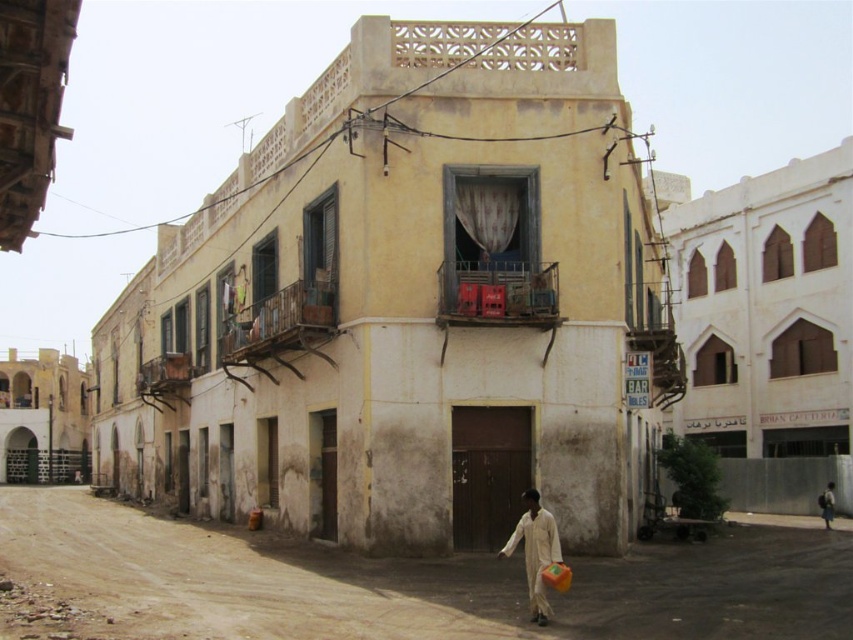
Based on the photo, does white cotton person at lower right have a greater width compared to light brown fabric bag at lower right?

Yes.

Which is in front, point (540, 516) or point (822, 520)?

Point (540, 516)

I want to click on white cotton person at lower right, so click(535, 552).

In the scene shown: Is the position of dull concrete alley at lower left less distant than that of white cotton person at lower right?

Yes.

Which is behind, point (698, 596) or point (540, 512)?

The point (698, 596) is behind.

Is point (189, 548) in front of point (544, 609)?

That is False.

Where is `dull concrete alley at lower left`? The image size is (853, 640). dull concrete alley at lower left is located at coordinates (392, 582).

Who is positioned more to the right, dull concrete alley at lower left or light brown fabric bag at lower right?

light brown fabric bag at lower right

Between point (78, 589) and point (830, 528), which one is positioned in front?

Point (78, 589) is in front.

The height and width of the screenshot is (640, 853). What do you see at coordinates (392, 582) in the screenshot?
I see `dull concrete alley at lower left` at bounding box center [392, 582].

What are the coordinates of `dull concrete alley at lower left` in the screenshot? It's located at (392, 582).